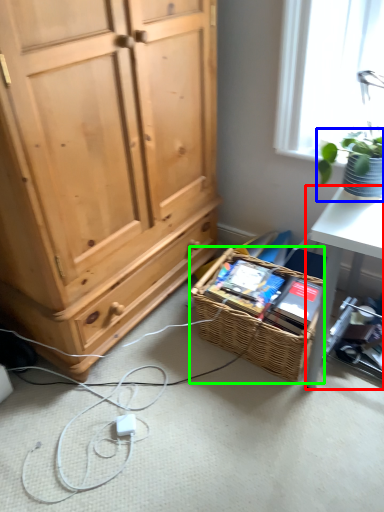
Question: Which is farther away from desk (highlighted by a red box)? houseplant (highlighted by a blue box) or picnic basket (highlighted by a green box)?

Choices:
 (A) houseplant
 (B) picnic basket

Answer: (A)